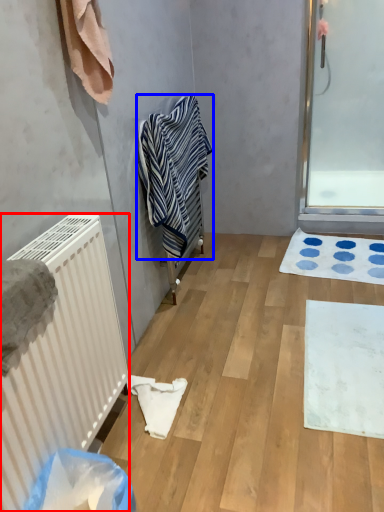
Question: Which point is closer to the camera, radiator (highlighted by a red box) or towel (highlighted by a blue box)?

Choices:
 (A) radiator
 (B) towel

Answer: (A)